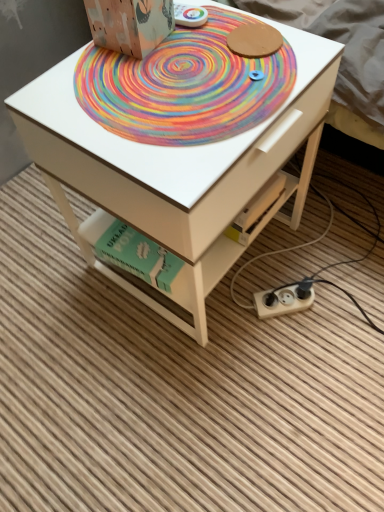
What do you see at coordinates (184, 86) in the screenshot?
I see `rainbow painted mat at center` at bounding box center [184, 86].

Find the location of a particular element. Image resolution: width=384 pixels, height=512 pixels. white plastic plug at lower right is located at coordinates (284, 300).

The image size is (384, 512). What do you see at coordinates (131, 250) in the screenshot?
I see `green cardboard book at lower center` at bounding box center [131, 250].

Locate an element on the screen. The width and height of the screenshot is (384, 512). white matte table at center is located at coordinates (174, 169).

What is the approximate width of wooden cardboard box at upper center?

The width of wooden cardboard box at upper center is 5.17 inches.

You are a GUI agent. You are given a task and a screenshot of the screen. Output one action in this format:
    pyautogui.click(x=<x>, y=<y>)
    Task: Click on the rainbow painted mat at center
    
    Given the screenshot: What is the action you would take?
    pyautogui.click(x=184, y=86)

From a real-world perspective, does white plastic plug at lower right stand above green cardboard book at lower center?

No, from a real-world perspective, white plastic plug at lower right is not over green cardboard book at lower center

From the picture: Can green cardboard book at lower center be found inside white plastic plug at lower right?

No, green cardboard book at lower center is located outside of white plastic plug at lower right.

Is white plastic plug at lower right oriented towards green cardboard book at lower center?

No, white plastic plug at lower right is not facing towards green cardboard book at lower center.

How far apart are white plastic plug at lower right and green cardboard book at lower center?

13.20 inches.

From a real-world perspective, is wooden cardboard box at upper center on top of rainbow painted mat at center?

Correct, in the physical world, wooden cardboard box at upper center is higher than rainbow painted mat at center.

Can you see wooden cardboard box at upper center touching rainbow painted mat at center?

wooden cardboard box at upper center and rainbow painted mat at center are not in contact.

Considering the relative sizes of wooden cardboard box at upper center and rainbow painted mat at center in the image provided, is wooden cardboard box at upper center bigger than rainbow painted mat at center?

Indeed, wooden cardboard box at upper center has a larger size compared to rainbow painted mat at center.

Considering the relative sizes of wooden cardboard box at upper center and rainbow painted mat at center in the image provided, is wooden cardboard box at upper center taller than rainbow painted mat at center?

Yes, wooden cardboard box at upper center is taller than rainbow painted mat at center.

Is white matte table at center at the right side of rainbow painted mat at center?

Yes, white matte table at center is to the right of rainbow painted mat at center.

Which object is thinner, white matte table at center or rainbow painted mat at center?

Thinner between the two is rainbow painted mat at center.

From the image's perspective, which object appears higher, white matte table at center or rainbow painted mat at center?

rainbow painted mat at center, from the image's perspective.

Who is taller, white matte table at center or rainbow painted mat at center?

With more height is white matte table at center.

Does white plastic plug at lower right contain rainbow painted mat at center?

No, white plastic plug at lower right does not contain rainbow painted mat at center.

Relative to rainbow painted mat at center, is white plastic plug at lower right in front or behind?

white plastic plug at lower right is behind rainbow painted mat at center.

Is point (268, 301) positioned after point (190, 34)?

That is True.

Is point (141, 175) positioned after point (272, 310)?

That is False.

Which object is more forward, white matte table at center or white plastic plug at lower right?

white matte table at center.

Between white matte table at center and white plastic plug at lower right, which one has larger size?

white matte table at center.

Where is `table lying above the white plastic plug at lower right (from the image's perspective)`? This screenshot has height=512, width=384. table lying above the white plastic plug at lower right (from the image's perspective) is located at coordinates (174, 169).

From the image's perspective, between rainbow painted mat at center and white plastic plug at lower right, who is located below?

white plastic plug at lower right appears lower in the image.

The image size is (384, 512). In the image, there is a white plastic plug at lower right. What are the coordinates of `mat above it (from the image's perspective)` in the screenshot? It's located at (184, 86).

Could you tell me if rainbow painted mat at center is facing white plastic plug at lower right?

No.

Is rainbow painted mat at center thinner than white plastic plug at lower right?

No, rainbow painted mat at center is not thinner than white plastic plug at lower right.

Based on their sizes in the image, would you say white plastic plug at lower right is bigger or smaller than wooden cardboard box at upper center?

In the image, white plastic plug at lower right appears to be smaller than wooden cardboard box at upper center.

Are white plastic plug at lower right and wooden cardboard box at upper center making contact?

There is a gap between white plastic plug at lower right and wooden cardboard box at upper center.

Which of these two, white plastic plug at lower right or wooden cardboard box at upper center, stands shorter?

Standing shorter between the two is white plastic plug at lower right.

Locate an element on the screen. book in front of the white plastic plug at lower right is located at coordinates (131, 250).

Where is `mat below the wooden cardboard box at upper center (from the image's perspective)`? mat below the wooden cardboard box at upper center (from the image's perspective) is located at coordinates (184, 86).

Which object lies nearer to the anchor point white plastic plug at lower right, wooden cardboard box at upper center or rainbow painted mat at center?

The object closer to white plastic plug at lower right is rainbow painted mat at center.

Which object lies nearer to the anchor point white matte table at center, rainbow painted mat at center or wooden cardboard box at upper center?

The object closer to white matte table at center is rainbow painted mat at center.

Considering their positions, is rainbow painted mat at center positioned further to white matte table at center than white plastic plug at lower right?

white plastic plug at lower right is positioned further to the anchor white matte table at center.

Considering their positions, is white plastic plug at lower right positioned further to white matte table at center than wooden cardboard box at upper center?

white plastic plug at lower right is positioned further to the anchor white matte table at center.

Based on the photo, looking at the image, which one is located closer to rainbow painted mat at center, wooden cardboard box at upper center or white matte table at center?

wooden cardboard box at upper center is positioned closer to the anchor rainbow painted mat at center.

Considering their positions, is white matte table at center positioned closer to wooden cardboard box at upper center than rainbow painted mat at center?

rainbow painted mat at center lies closer to wooden cardboard box at upper center than the other object.

From the image, which object appears to be nearer to white plastic plug at lower right, white matte table at center or rainbow painted mat at center?

Based on the image, white matte table at center appears to be nearer to white plastic plug at lower right.

When comparing their distances from white matte table at center, does white plastic plug at lower right or rainbow painted mat at center seem closer?

rainbow painted mat at center is closer to white matte table at center.

Locate an element on the screen. This screenshot has height=512, width=384. table between wooden cardboard box at upper center and white plastic plug at lower right in the up-down direction is located at coordinates (174, 169).

Where is `table between wooden cardboard box at upper center and green cardboard book at lower center from top to bottom`? Image resolution: width=384 pixels, height=512 pixels. table between wooden cardboard box at upper center and green cardboard book at lower center from top to bottom is located at coordinates (174, 169).

Where is `book between rainbow painted mat at center and white plastic plug at lower right vertically`? book between rainbow painted mat at center and white plastic plug at lower right vertically is located at coordinates (131, 250).

You are a GUI agent. You are given a task and a screenshot of the screen. Output one action in this format:
    pyautogui.click(x=<x>, y=<y>)
    Task: Click on the book between white matte table at center and white plastic plug at lower right along the z-axis
    Image resolution: width=384 pixels, height=512 pixels.
    Given the screenshot: What is the action you would take?
    pyautogui.click(x=131, y=250)